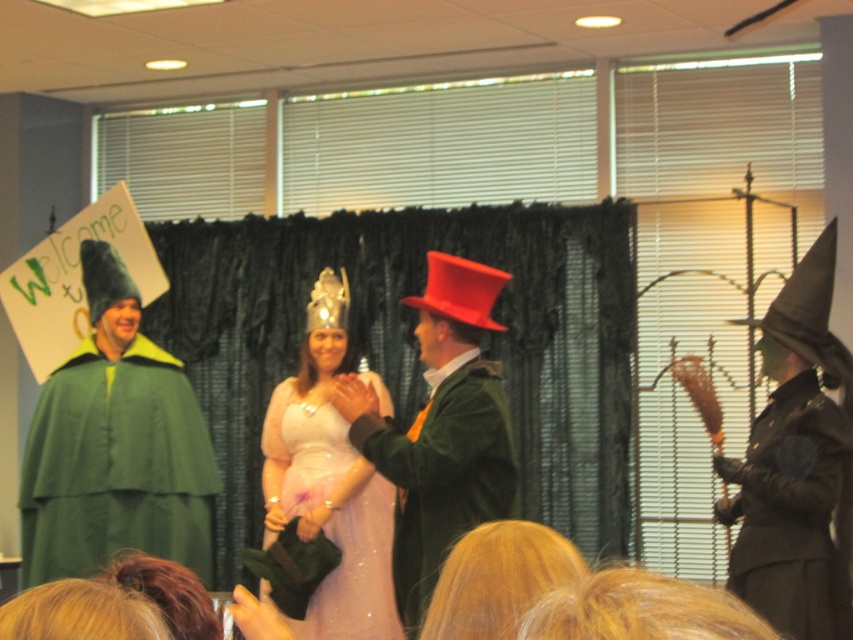
Question: Which of the following is the closest to the observer?

Choices:
 (A) (192, 394)
 (B) (830, 429)
 (C) (335, 387)

Answer: (B)

Question: Can you confirm if pale pink satin dress at center is wider than black matte robe at right?

Choices:
 (A) no
 (B) yes

Answer: (B)

Question: Which of the following is the closest to the observer?

Choices:
 (A) pale pink satin dress at center
 (B) black matte robe at right
 (C) velvet green coat at center
 (D) shiny red top hat at center

Answer: (C)

Question: Can you confirm if black matte robe at right is thinner than shiny red top hat at center?

Choices:
 (A) no
 (B) yes

Answer: (A)

Question: Does matte green cape at left appear over velvet green coat at center?

Choices:
 (A) yes
 (B) no

Answer: (A)

Question: Which point appears farthest from the camera in this image?

Choices:
 (A) pos(734,465)
 (B) pos(105,545)

Answer: (B)